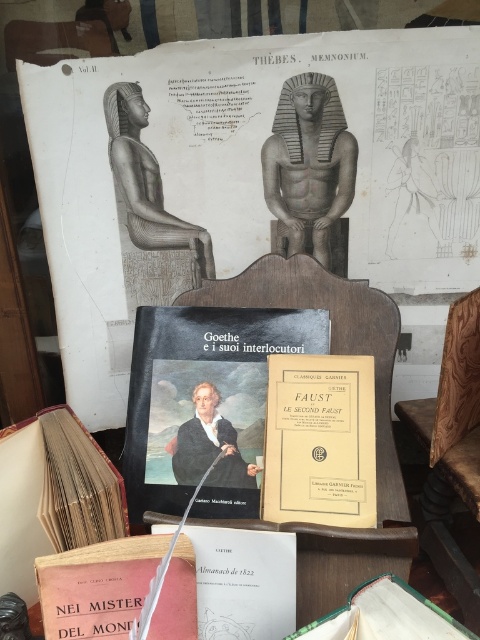
What are the coordinates of the matte paper poster at upper center?

The coordinates of the matte paper poster at upper center are at point (249, 176).

From the picture: You are organizing books on a table and notice the white paper book at center and the hardcover book at center. Which book is placed lower on the table?

The white paper book at center is positioned under the hardcover book at center, so it is placed lower on the table.

You are a researcher who needs to place a 3.5 inch wide artifact between the white paper book at center and the hardcover book at center. Can the artifact fit in the space between them?

The distance between the white paper book at center and the hardcover book at center is 2.98 inches, which is less than the artifact width of 3.5 inches. Therefore, the artifact cannot fit between them.